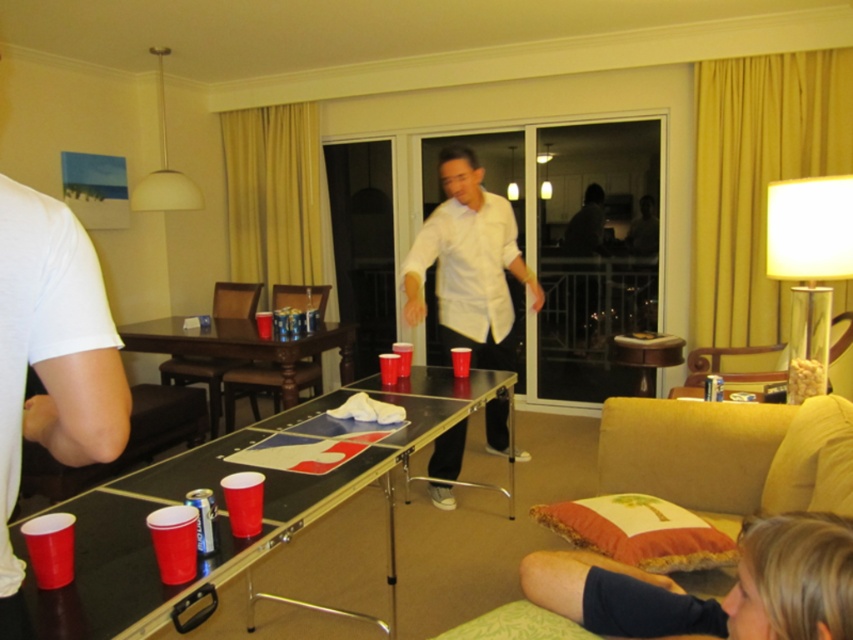
I want to click on white matte shirt at center, so click(468, 264).

Is point (473, 320) closer to camera compared to point (260, 360)?

That is True.

Which is in front, point (438, 324) or point (286, 364)?

Point (286, 364)

Locate an element on the screen. Image resolution: width=853 pixels, height=640 pixels. white matte shirt at center is located at coordinates (468, 264).

Between white matte t-shirt at left and wooden table at center, which one has more height?

Standing taller between the two is wooden table at center.

The width and height of the screenshot is (853, 640). Describe the element at coordinates (50, 360) in the screenshot. I see `white matte t-shirt at left` at that location.

What do you see at coordinates (50, 360) in the screenshot? I see `white matte t-shirt at left` at bounding box center [50, 360].

The height and width of the screenshot is (640, 853). What are the coordinates of `white matte t-shirt at left` in the screenshot? It's located at (50, 360).

Which is above, blonde hair at lower right or white matte shirt at center?

white matte shirt at center is above.

Does blonde hair at lower right have a lesser width compared to white matte shirt at center?

Correct, blonde hair at lower right's width is less than white matte shirt at center's.

Is point (636, 611) positioned in front of point (453, 195)?

That is True.

Image resolution: width=853 pixels, height=640 pixels. Find the location of `blonde hair at lower right`. blonde hair at lower right is located at coordinates (712, 600).